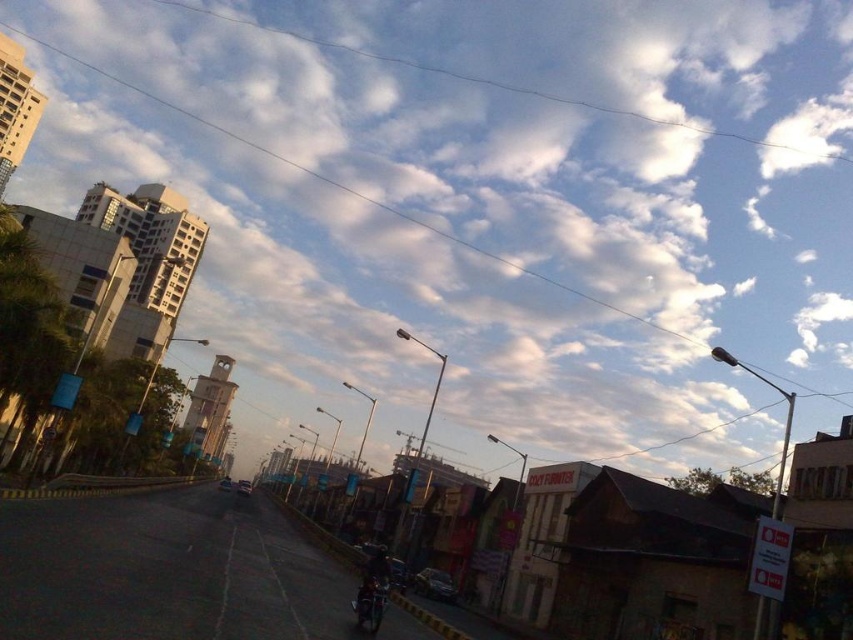
Which is more to the left, white fluffy cloud at upper center or shiny metallic motorcycle at center?

From the viewer's perspective, shiny metallic motorcycle at center appears more on the left side.

Describe the element at coordinates (485, 208) in the screenshot. I see `white fluffy cloud at upper center` at that location.

Find the location of a particular element. white fluffy cloud at upper center is located at coordinates (485, 208).